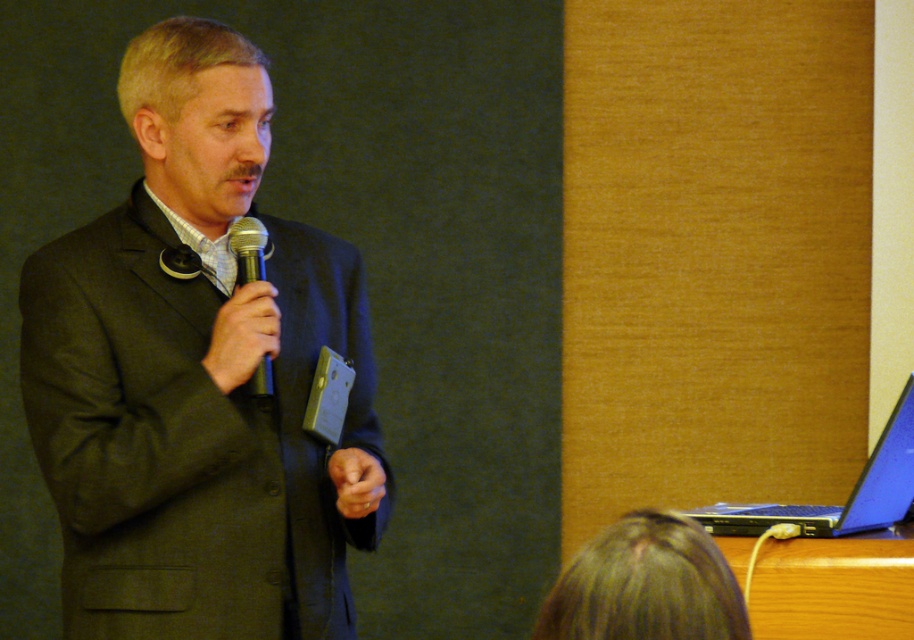
Based on the photo, you are organizing a presentation and need to place the blue glossy laptop at lower right and the black matte microphone at center on a table. Given their sizes, which object will you need to adjust to ensure they both fit comfortably on the table?

The blue glossy laptop at lower right is not as tall as the black matte microphone at center, so you should adjust the placement of the microphone to make sure there is enough space for both items on the table.

You are an attendee at this presentation. You notice two points marked in the room. The first point is at coordinates point (x=891, y=412) and the second point is at point (x=250, y=259). Which point is closer to you as you sit in the audience?

Point (x=891, y=412) is closer to you as you sit in the audience because it is further to the viewer than point (x=250, y=259).